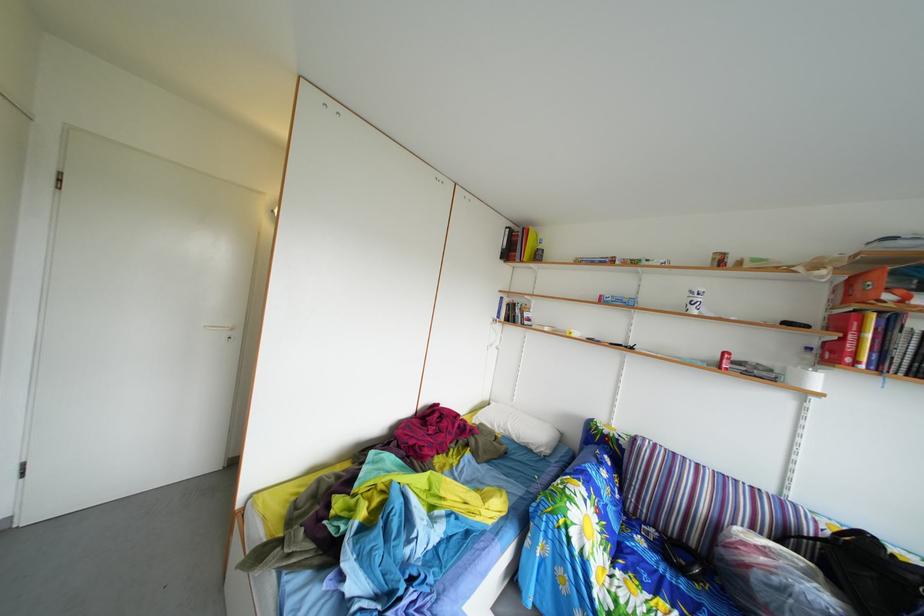
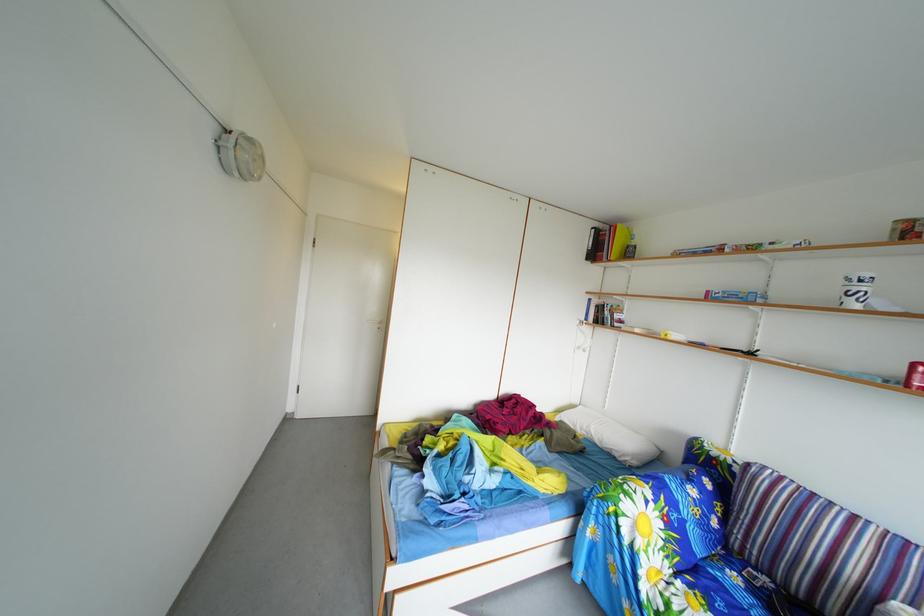
Locate, in the second image, the point that corresponds to point 529,447 in the first image.

(612, 451)